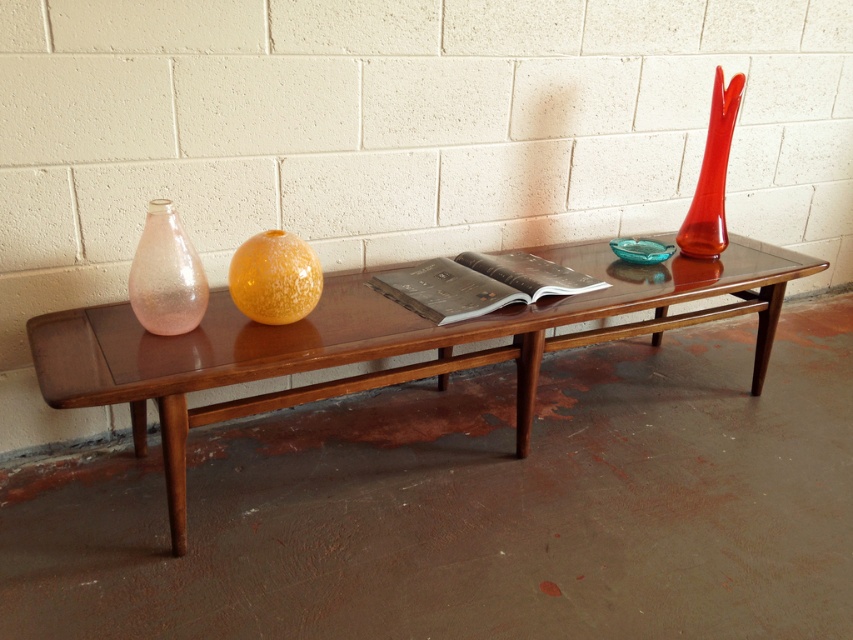
Does translucent amber sphere at center appear on the right side of translucent red glass vase at right?

In fact, translucent amber sphere at center is to the left of translucent red glass vase at right.

Measure the distance between point [299,244] and camera.

A distance of 5.51 feet exists between point [299,244] and camera.

You are a GUI agent. You are given a task and a screenshot of the screen. Output one action in this format:
    pyautogui.click(x=<x>, y=<y>)
    Task: Click on the translucent amber sphere at center
    
    Given the screenshot: What is the action you would take?
    pyautogui.click(x=274, y=276)

Who is positioned more to the right, glossy wood table at center or translucent red glass vase at right?

From the viewer's perspective, translucent red glass vase at right appears more on the right side.

This screenshot has width=853, height=640. What do you see at coordinates (380, 342) in the screenshot?
I see `glossy wood table at center` at bounding box center [380, 342].

Locate an element on the screen. glossy wood table at center is located at coordinates (380, 342).

Does point (399, 369) come behind point (200, 275)?

That is True.

Which is more to the right, glossy wood table at center or translucent pink glass vase at left?

glossy wood table at center is more to the right.

The width and height of the screenshot is (853, 640). Find the location of `glossy wood table at center`. glossy wood table at center is located at coordinates (380, 342).